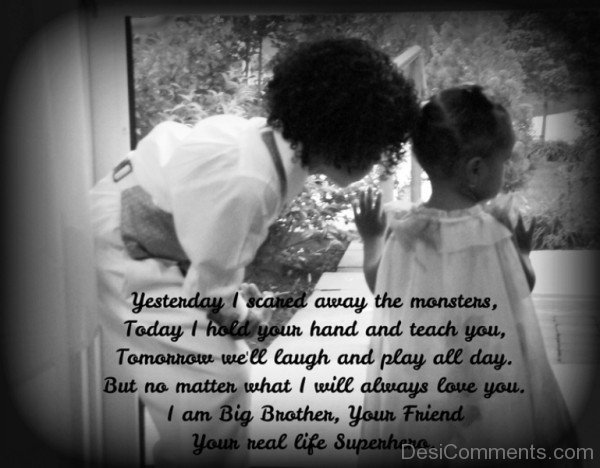
Where is `handle`? The height and width of the screenshot is (468, 600). handle is located at coordinates (410, 57).